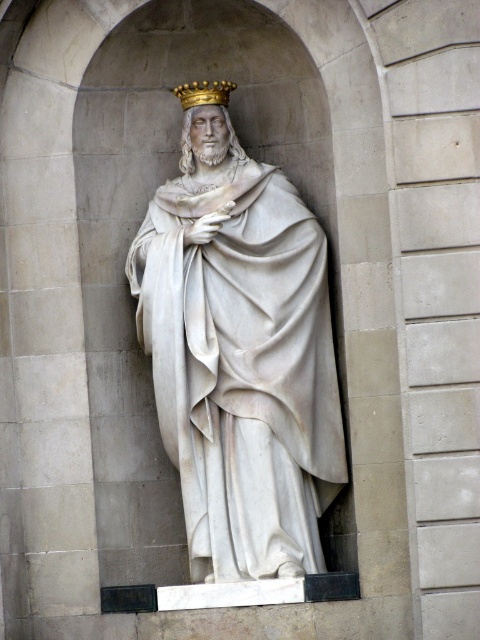
Question: Which point appears closest to the camera in this image?

Choices:
 (A) (264, 308)
 (B) (204, 99)

Answer: (A)

Question: Which of the following is the closest to the observer?

Choices:
 (A) gold metallic crown at upper center
 (B) white marble statue at center

Answer: (B)

Question: Is white marble statue at center positioned at the back of gold metallic crown at upper center?

Choices:
 (A) yes
 (B) no

Answer: (B)

Question: Which point appears closest to the camera in this image?

Choices:
 (A) (188, 145)
 (B) (204, 198)
 (C) (192, 84)

Answer: (B)

Question: Can you confirm if golden crown at center is positioned below gold metallic crown at upper center?

Choices:
 (A) no
 (B) yes

Answer: (A)

Question: Does golden crown at center appear on the right side of gold metallic crown at upper center?

Choices:
 (A) no
 (B) yes

Answer: (B)